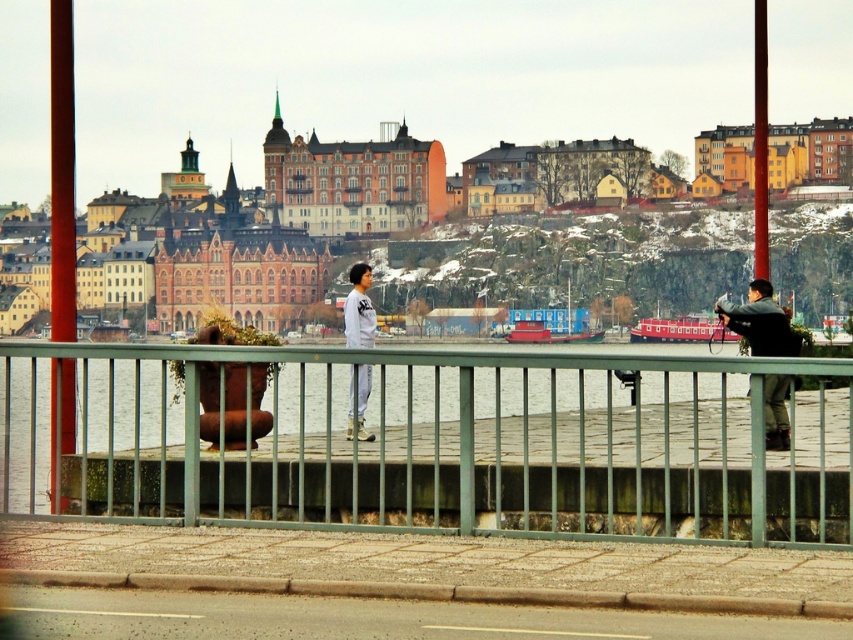
Based on the photo, between green metal fence at center and white matte jacket at center, which one has less height?

Standing shorter between the two is green metal fence at center.

Between green metal fence at center and white matte jacket at center, which one has more height?

white matte jacket at center

Describe the element at coordinates (438, 444) in the screenshot. This screenshot has height=640, width=853. I see `green metal fence at center` at that location.

The width and height of the screenshot is (853, 640). Find the location of `green metal fence at center`. green metal fence at center is located at coordinates (438, 444).

Does green metal fence at center have a greater width compared to dark gray jacket at right?

Yes, green metal fence at center is wider than dark gray jacket at right.

Locate an element on the screen. green metal fence at center is located at coordinates (438, 444).

Is dark gray jacket at right taller than white matte jacket at center?

Incorrect, dark gray jacket at right's height is not larger of white matte jacket at center's.

Does point (775, 419) come closer to viewer compared to point (352, 344)?

Yes, point (775, 419) is in front of point (352, 344).

Locate an element on the screen. This screenshot has height=640, width=853. dark gray jacket at right is located at coordinates (759, 321).